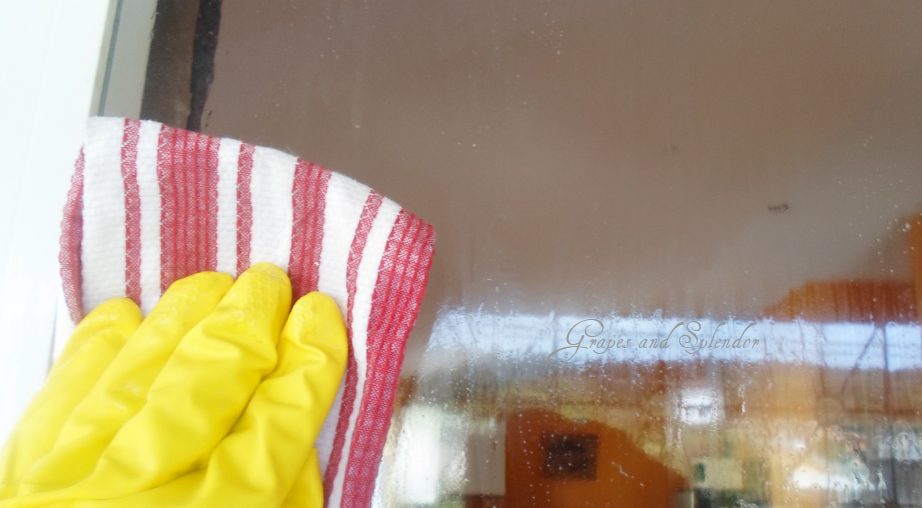
You are a GUI agent. You are given a task and a screenshot of the screen. Output one action in this format:
    pyautogui.click(x=<x>, y=<y>)
    Task: Click on the towel
    The height and width of the screenshot is (508, 922).
    Given the screenshot: What is the action you would take?
    pyautogui.click(x=242, y=254)